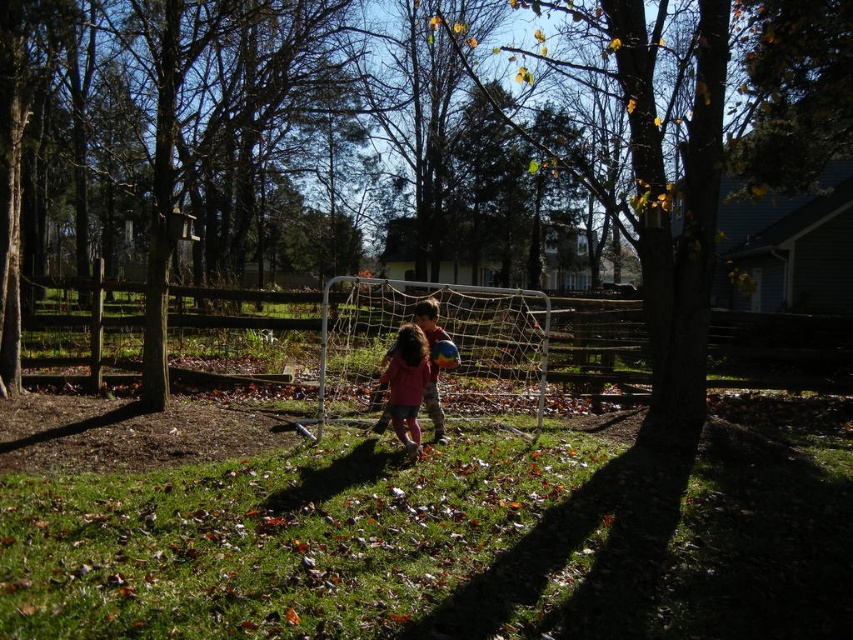
Can you confirm if wooden fence at center is positioned above matte pink dress at center?

Yes.

Does wooden fence at center have a lesser width compared to matte pink dress at center?

No, wooden fence at center is not thinner than matte pink dress at center.

The image size is (853, 640). I want to click on wooden fence at center, so click(393, 340).